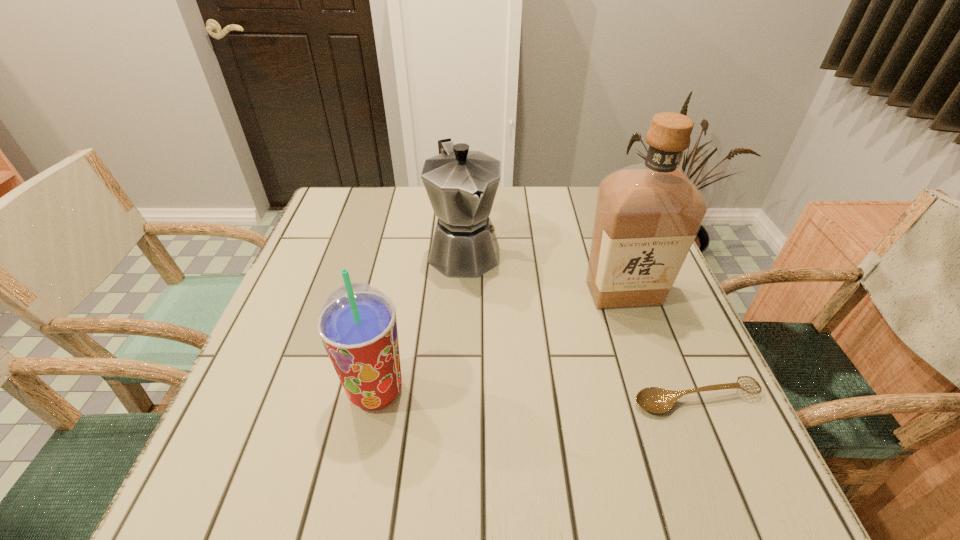
Locate an element on the screen. This screenshot has width=960, height=540. vacant space situated on the front-facing side of the tallest object is located at coordinates (561, 427).

Find the location of a particular element. vacant space located on the front-facing side of the tallest object is located at coordinates (566, 414).

Find the location of a particular element. The width and height of the screenshot is (960, 540). object situated at the far edge is located at coordinates (461, 185).

The width and height of the screenshot is (960, 540). Find the location of `smoothie located at the near edge`. smoothie located at the near edge is located at coordinates (357, 324).

This screenshot has width=960, height=540. Identify the location of ladle present at the near edge. (654, 399).

The height and width of the screenshot is (540, 960). I want to click on ladle located at the right edge, so click(654, 399).

The width and height of the screenshot is (960, 540). In order to click on liquor that is at the right edge in this screenshot , I will do `click(647, 215)`.

Identify the location of object that is positioned at the near right corner. The width and height of the screenshot is (960, 540). tap(654, 399).

You are a GUI agent. You are given a task and a screenshot of the screen. Output one action in this format:
    pyautogui.click(x=<x>, y=<y>)
    Task: Click on the vacant space at the far edge of the desktop
    Image resolution: width=960 pixels, height=540 pixels.
    Given the screenshot: What is the action you would take?
    pyautogui.click(x=498, y=230)

Find the location of a particular element. vacant space at the near edge of the desktop is located at coordinates 608,411.